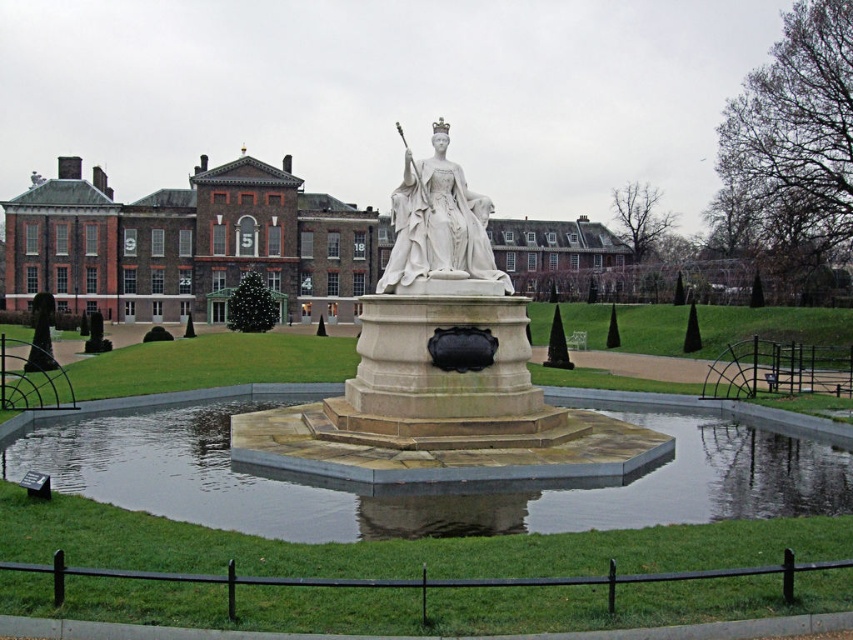
Based on the photo, you are standing at the point labeled point [392,364] and want to walk towards the building. Which direction should you move relative to point [520,241]?

Since point [392,364] is in front of point [520,241], you should move backward towards the building, away from point [520,241].

You are an architect designing a new garden layout. You need to place a new rectangular flower bed between the white marble fountain at center and the brown brick palace at center. Given that the fountain is thinner than the palace, which side of the flower bed should align with the narrower side of the fountain to maintain symmetry?

The white marble fountain at center is thinner than the brown brick palace at center, so the narrower side of the white marble fountain at center should align with the side of the flower bed closest to it to maintain symmetry.

You are a maintenance worker who needs to clean the white stone fountain at center and the smooth stone pond at center. Which one should you clean first if you want to start from the lower elevation?

The smooth stone pond at center should be cleaned first because the white stone fountain at center is above it, meaning the pond is at a lower elevation.